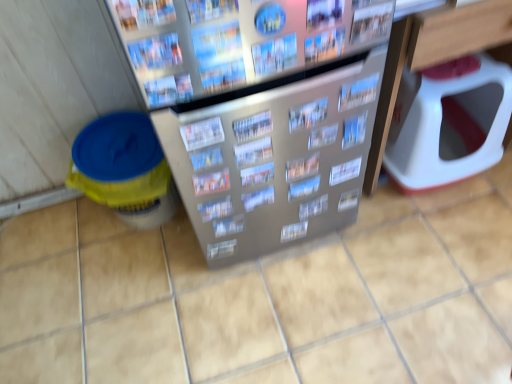
Question: Is point (129, 190) positioned closer to the camera than point (199, 145)?

Choices:
 (A) closer
 (B) farther

Answer: (B)

Question: In terms of height, does yellow plastic bucket at left look taller or shorter compared to printed paper magazine at center, marked as the 8th magazine in a front-to-back arrangement?

Choices:
 (A) tall
 (B) short

Answer: (A)

Question: Estimate the real-world distances between objects in this image. Which object is closer to the metallic silver magazine at upper center, positioned as the 7th magazine in back-to-front order?

Choices:
 (A) metallic silver magazine at center, which is the fifth magazine from front to back
 (B) metallic silver magazine at center, the 4th magazine from the front
 (C) printed paper magazine at center, positioned as the 2th magazine in back-to-front order
 (D) yellow plastic bucket at left
 (E) printed paper magazine at upper center, positioned as the 12th magazine in back-to-front order

Answer: (B)

Question: Which object is the closest to the printed paper magazine at center, the eleventh magazine in the back-to-front sequence?

Choices:
 (A) printed paper magazine at upper center, positioned as the 12th magazine in back-to-front order
 (B) white plastic toilet at right
 (C) printed paper magazine at center, marked as the 8th magazine in a front-to-back arrangement
 (D) metallic silver magazine at center, which is the fifth magazine from front to back
 (E) printed paper magazine at center, positioned as the 2th magazine in back-to-front order

Answer: (A)